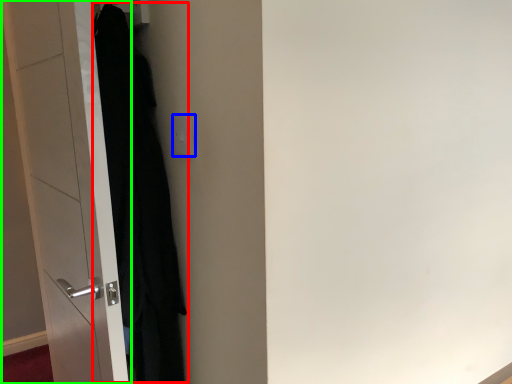
Question: Which object is positioned farthest from clothing (highlighted by a red box)? Select from electric outlet (highlighted by a blue box) and door (highlighted by a green box).

Choices:
 (A) electric outlet
 (B) door

Answer: (A)